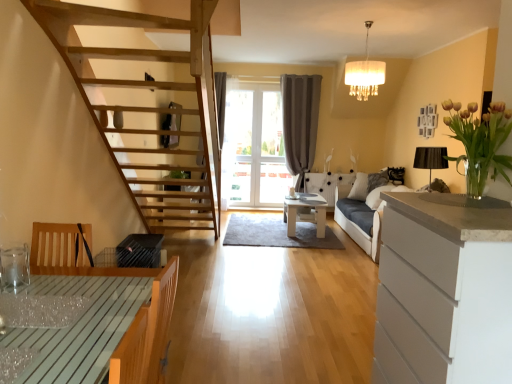
Find the location of a particular element. The height and width of the screenshot is (384, 512). vacant space behind transparent glass table at lower left is located at coordinates (81, 283).